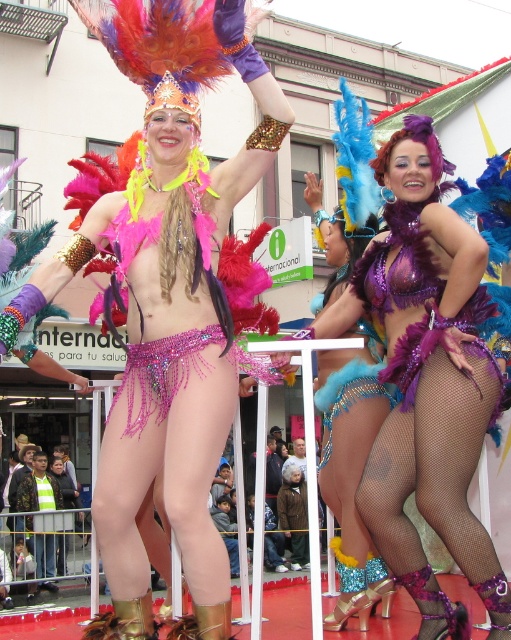
Question: Does shiny sequined bikini at center have a larger size compared to shiny blue fabric at center?

Choices:
 (A) no
 (B) yes

Answer: (B)

Question: Which point is farther to the camera?

Choices:
 (A) shiny purple bikini at center
 (B) shiny blue fabric at center
 (C) shiny sequined bikini at center

Answer: (B)

Question: Does shiny sequined bikini at center have a greater width compared to shiny blue fabric at center?

Choices:
 (A) no
 (B) yes

Answer: (B)

Question: Among these points, which one is nearest to the camera?

Choices:
 (A) (313, 189)
 (B) (480, 378)
 (C) (167, 224)

Answer: (B)

Question: Which point is farther from the camera taking this photo?

Choices:
 (A) 352,577
 (B) 164,301
 (C) 434,355

Answer: (A)

Question: Does shiny sequined bikini at center have a greater width compared to shiny purple bikini at center?

Choices:
 (A) yes
 (B) no

Answer: (A)